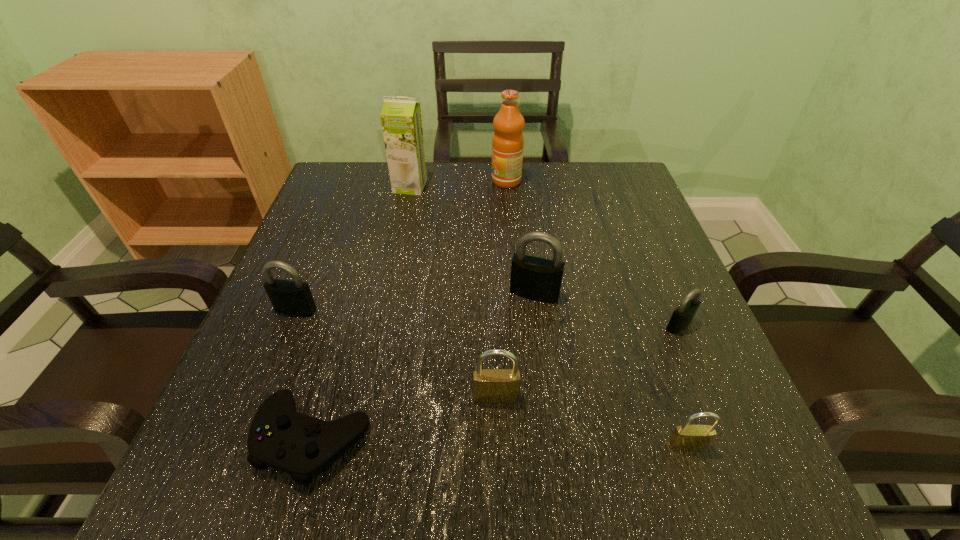
Where is `vacant point located between the left brass padlock and the second black padlock from left to right`? vacant point located between the left brass padlock and the second black padlock from left to right is located at coordinates (516, 345).

Locate an element on the screen. The width and height of the screenshot is (960, 540). empty space between the fruit juice and the left brass padlock is located at coordinates (501, 289).

Find the location of a particular element. free spot between the second black padlock from right to left and the fruit juice is located at coordinates (520, 237).

Where is `free space between the fruit juice and the bigger brass padlock`? This screenshot has height=540, width=960. free space between the fruit juice and the bigger brass padlock is located at coordinates (501, 289).

I want to click on free space that is in between the farther brass padlock and the leftmost padlock, so click(x=396, y=353).

Find the location of a particular element. vacant point located between the biggest black padlock and the control is located at coordinates (423, 366).

Image resolution: width=960 pixels, height=540 pixels. In order to click on object that can be found as the fourth closest to the tallest padlock in this screenshot , I will do `click(685, 437)`.

Where is `object that stands as the closest to the fruit juice`? Image resolution: width=960 pixels, height=540 pixels. object that stands as the closest to the fruit juice is located at coordinates (401, 121).

Image resolution: width=960 pixels, height=540 pixels. I want to click on padlock identified as the fourth closest to the seventh object from left to right, so click(x=294, y=297).

What are the coordinates of `padlock that is the third nearest to the control` in the screenshot? It's located at (538, 279).